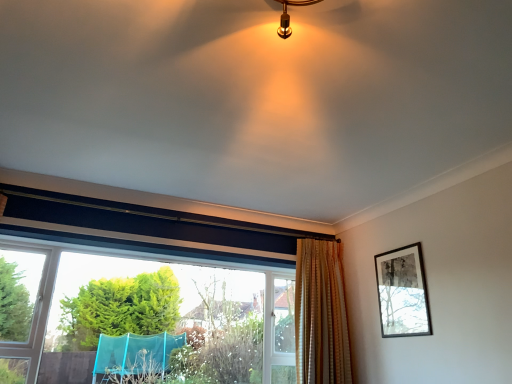
Question: Considering the relative sizes of gold textured curtain at center and clear glass window at lower left in the image provided, is gold textured curtain at center smaller than clear glass window at lower left?

Choices:
 (A) no
 (B) yes

Answer: (B)

Question: Is gold textured curtain at center looking in the opposite direction of clear glass window at lower left?

Choices:
 (A) no
 (B) yes

Answer: (B)

Question: Can you confirm if gold textured curtain at center is positioned to the left of clear glass window at lower left?

Choices:
 (A) yes
 (B) no

Answer: (B)

Question: Is the surface of gold textured curtain at center in direct contact with clear glass window at lower left?

Choices:
 (A) no
 (B) yes

Answer: (A)

Question: Does gold textured curtain at center lie behind clear glass window at lower left?

Choices:
 (A) no
 (B) yes

Answer: (B)

Question: Considering the positions of clear glass window at lower left and gold textured curtain at center in the image, is clear glass window at lower left wider or thinner than gold textured curtain at center?

Choices:
 (A) wide
 (B) thin

Answer: (A)

Question: Is point (106, 334) positioned closer to the camera than point (295, 263)?

Choices:
 (A) closer
 (B) farther

Answer: (A)

Question: Is clear glass window at lower left situated inside gold textured curtain at center or outside?

Choices:
 (A) outside
 (B) inside

Answer: (A)

Question: In terms of size, does clear glass window at lower left appear bigger or smaller than gold textured curtain at center?

Choices:
 (A) small
 (B) big

Answer: (B)

Question: From a real-world perspective, relative to gold textured curtain at center, is black matte picture frame at upper right vertically above or below?

Choices:
 (A) below
 (B) above

Answer: (B)

Question: In terms of height, does black matte picture frame at upper right look taller or shorter compared to gold textured curtain at center?

Choices:
 (A) tall
 (B) short

Answer: (B)

Question: Considering the positions of black matte picture frame at upper right and gold textured curtain at center in the image, is black matte picture frame at upper right bigger or smaller than gold textured curtain at center?

Choices:
 (A) small
 (B) big

Answer: (A)

Question: Does point (379, 253) appear closer or farther from the camera than point (302, 261)?

Choices:
 (A) farther
 (B) closer

Answer: (B)

Question: From the image's perspective, relative to black matte picture frame at upper right, is gold textured curtain at center above or below?

Choices:
 (A) below
 (B) above

Answer: (A)

Question: Is point (342, 319) closer or farther from the camera than point (390, 269)?

Choices:
 (A) closer
 (B) farther

Answer: (B)